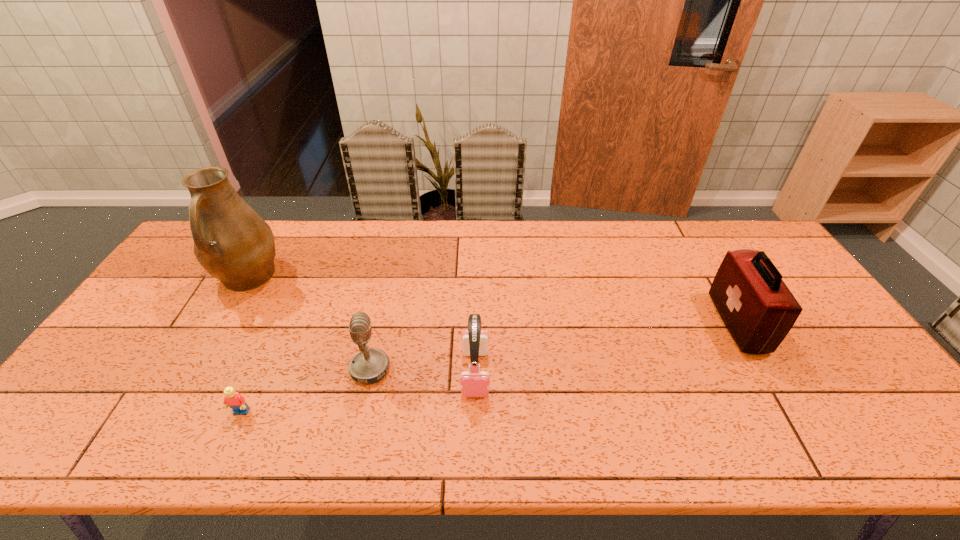
Where is `free area in between the third object from right to left and the earphone`? free area in between the third object from right to left and the earphone is located at coordinates (422, 371).

The width and height of the screenshot is (960, 540). What are the coordinates of `free space between the fourth object from right to left and the first aid kit` in the screenshot? It's located at (490, 368).

Locate which object ranks in proximity to the third object from right to left. Please provide its 2D coordinates. Your answer should be formatted as a tuple, i.e. [(x, y)], where the tuple contains the x and y coordinates of a point satisfying the conditions above.

[(474, 383)]

Identify which object is located as the fourth nearest to the third object from left to right. Please provide its 2D coordinates. Your answer should be formatted as a tuple, i.e. [(x, y)], where the tuple contains the x and y coordinates of a point satisfying the conditions above.

[(758, 309)]

Image resolution: width=960 pixels, height=540 pixels. I want to click on vacant space that satisfies the following two spatial constraints: 1. on the front-facing side of the third object from left to right; 2. on the face of the shortest object, so click(x=360, y=413).

Locate an element on the screen. free spot that satisfies the following two spatial constraints: 1. on the side of the first aid kit with the cross symbol; 2. on the face of the shortest object is located at coordinates (789, 413).

Find the location of a particular element. vacant space that satisfies the following two spatial constraints: 1. on the side of the rightmost object with the cross symbol; 2. on the face of the shortest object is located at coordinates (789, 413).

You are a GUI agent. You are given a task and a screenshot of the screen. Output one action in this format:
    pyautogui.click(x=<x>, y=<y>)
    Task: Click on the vacant space that satisfies the following two spatial constraints: 1. on the side of the first aid kit with the cross symbol; 2. on the outer surface of the earphone
    
    Given the screenshot: What is the action you would take?
    pyautogui.click(x=766, y=373)

Where is `vacant space that satisfies the following two spatial constraints: 1. on the side of the first aid kit with the cross symbol; 2. on the face of the nearest object`? vacant space that satisfies the following two spatial constraints: 1. on the side of the first aid kit with the cross symbol; 2. on the face of the nearest object is located at coordinates (789, 413).

At what (x,y) coordinates should I click in order to perform the action: click on free space that satisfies the following two spatial constraints: 1. on the side of the first aid kit with the cross symbol; 2. on the face of the second object from left to right. Please return your answer as a coordinate pair (x, y). The width and height of the screenshot is (960, 540). Looking at the image, I should click on (789, 413).